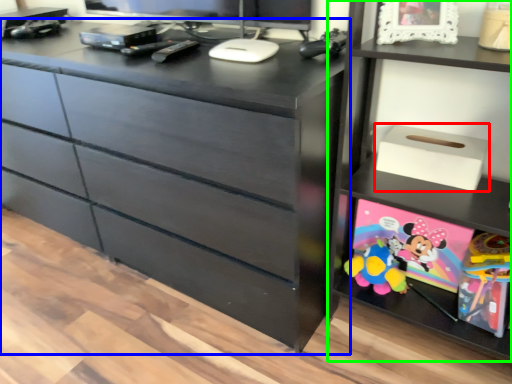
Question: Which object is the farthest from storage box (highlighted by a red box)? Choose among these: chest of drawers (highlighted by a blue box) or shelf (highlighted by a green box).

Choices:
 (A) chest of drawers
 (B) shelf

Answer: (A)